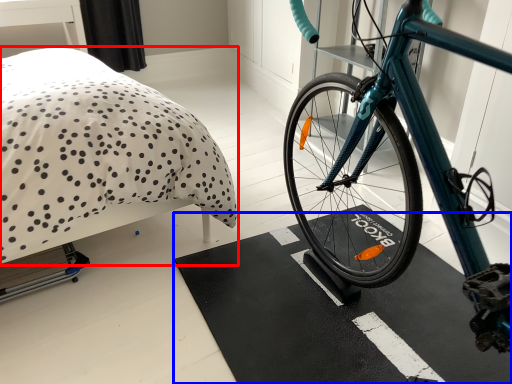
Question: Which point is closer to the camera, bed (highlighted by a red box) or bath mat (highlighted by a blue box)?

Choices:
 (A) bed
 (B) bath mat

Answer: (A)